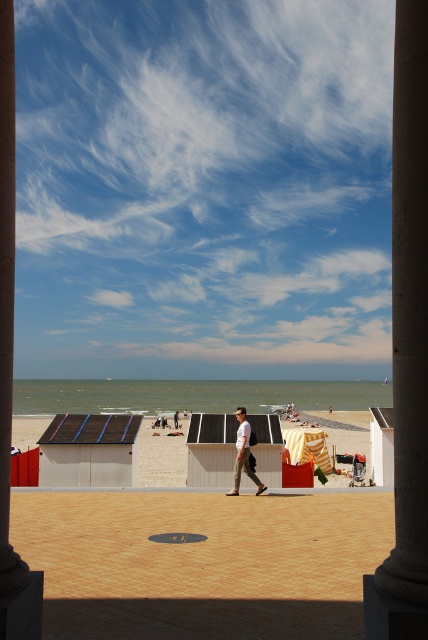
Question: Can you confirm if beige sand beach at center is positioned to the left of light brown leather pants at center?

Choices:
 (A) yes
 (B) no

Answer: (A)

Question: Is white wood beach hut at center closer to the viewer compared to beige fabric beach hut at center?

Choices:
 (A) no
 (B) yes

Answer: (A)

Question: Which point appears closest to the camera in this image?

Choices:
 (A) (68, 429)
 (B) (41, 580)
 (C) (422, 4)
 (D) (205, 458)

Answer: (C)

Question: Which point is farther to the camera?

Choices:
 (A) brown stone pillar at center
 (B) beige sand beach at center

Answer: (B)

Question: Among these objects, which one is farthest from the camera?

Choices:
 (A) beige fabric beach hut at center
 (B) light brown leather pants at center

Answer: (B)

Question: Does smooth concrete pillar at left have a larger size compared to dark gray solar panel at center?

Choices:
 (A) yes
 (B) no

Answer: (B)